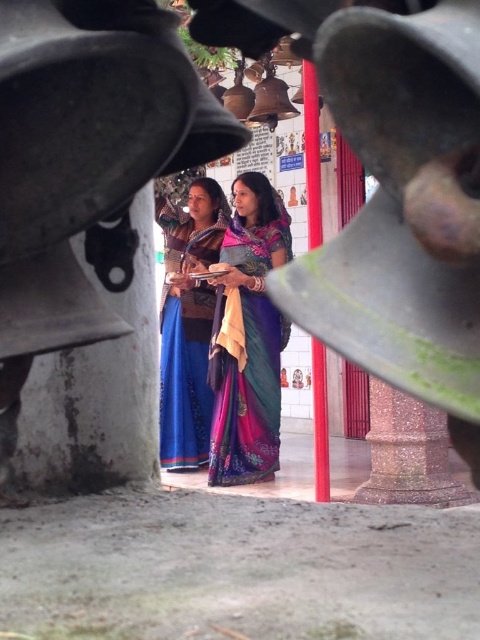
In order to click on silky blue sari at center in this screenshot , I will do `click(248, 337)`.

Can you confirm if silky blue sari at center is smaller than blue silk saree at center?

Indeed, silky blue sari at center has a smaller size compared to blue silk saree at center.

The height and width of the screenshot is (640, 480). Find the location of `silky blue sari at center`. silky blue sari at center is located at coordinates (248, 337).